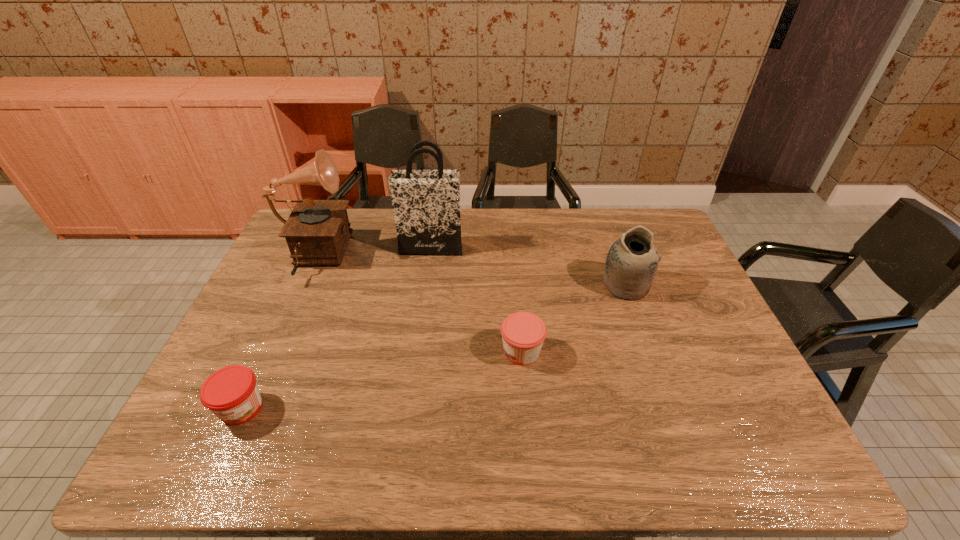
Locate an element on the screen. Image resolution: width=960 pixels, height=540 pixels. object at the far left corner is located at coordinates (317, 232).

Find the location of a particular element. This screenshot has height=540, width=960. vacant region at the far edge of the desktop is located at coordinates (546, 210).

Locate an element on the screen. vacant space at the near edge of the desktop is located at coordinates (664, 462).

I want to click on vacant region at the right edge of the desktop, so click(x=687, y=342).

At what (x,y) coordinates should I click in order to perform the action: click on blank space at the near left corner of the desktop. Please return your answer as a coordinate pair (x, y). This screenshot has width=960, height=540. Looking at the image, I should click on click(x=206, y=454).

You are a GUI agent. You are given a task and a screenshot of the screen. Output one action in this format:
    pyautogui.click(x=<x>, y=<y>)
    Task: Click on the vacant area between the pottery and the record player
    Image resolution: width=960 pixels, height=540 pixels.
    Given the screenshot: What is the action you would take?
    pyautogui.click(x=469, y=272)

Identify the location of free point between the rightmost object and the left jam. Image resolution: width=960 pixels, height=540 pixels. click(434, 346).

Identify the location of free area in between the third object from left to right and the nearer jam. The height and width of the screenshot is (540, 960). (336, 328).

The height and width of the screenshot is (540, 960). Identify the location of empty location between the record player and the nearest object. (276, 333).

Identify the location of free point between the third object from left to right and the second nearest object. (476, 300).